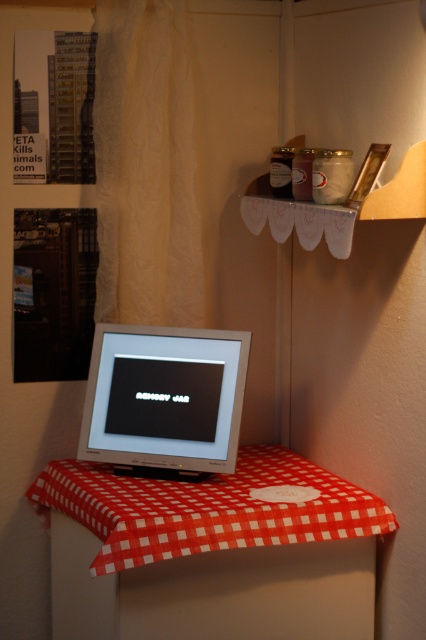
You are standing in the cozy corner setup and notice the beige paper curtain at upper left. Where is it positioned relative to the other objects in the scene?

The beige paper curtain at upper left is located at point coordinates (x=146, y=164).

You are standing in the room and want to hang a new poster. The point at coordinates (x=146, y=164) is on a beige paper curtain at upper left. Where should you avoid placing your new poster to prevent overlapping with existing decorations?

You should avoid placing your new poster near the point at coordinates (x=146, y=164) because that area is already occupied by the beige paper curtain at upper left.

Consider the image. You are organizing a room and need to decide which object to move first. Based on their sizes, which object should you move first, the beige paper curtain at upper left or the red checkered cloth at center?

The beige paper curtain at upper left has a smaller size compared to the red checkered cloth at center, so you should move the beige paper curtain at upper left first since it is smaller and easier to handle.